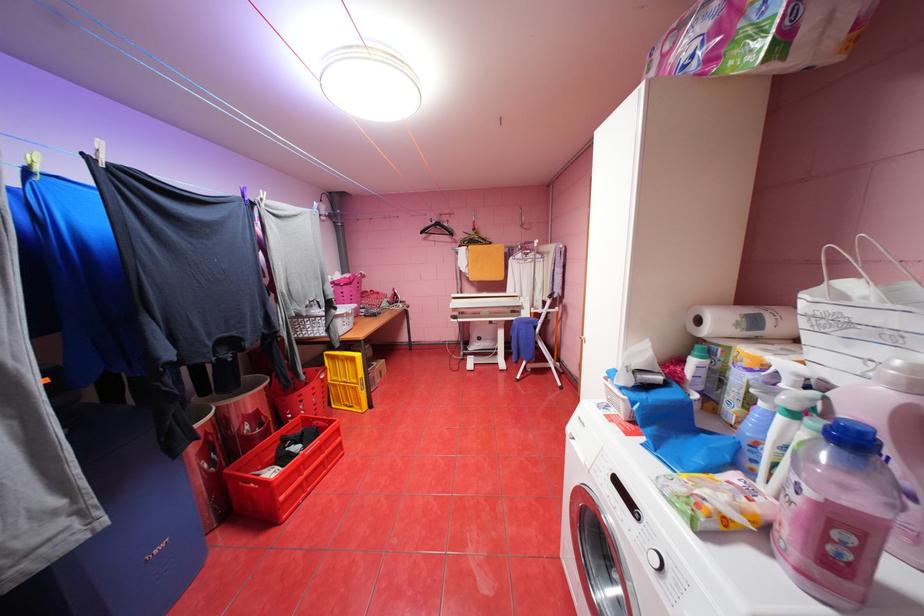
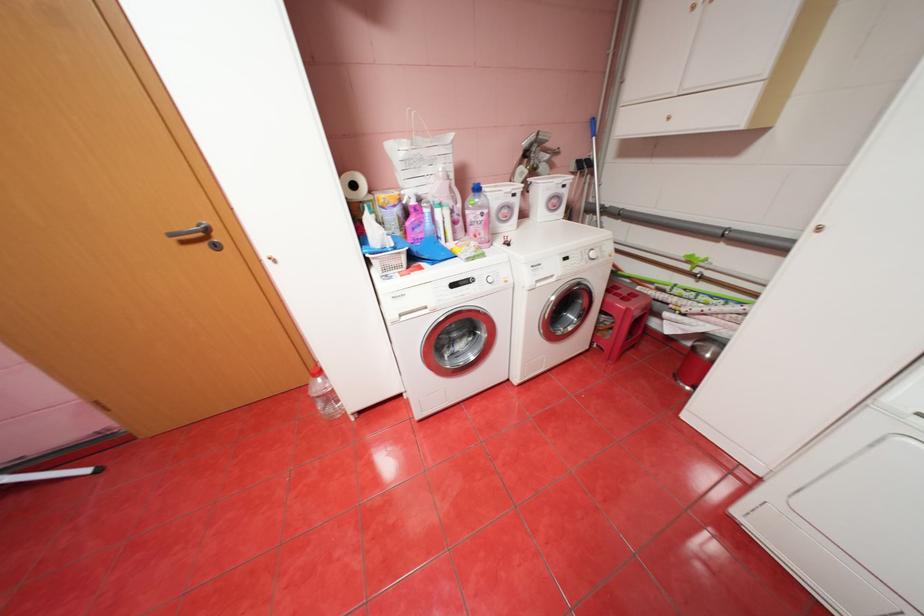
Locate, in the second image, the point that corresponds to [708,321] in the first image.

(362, 185)